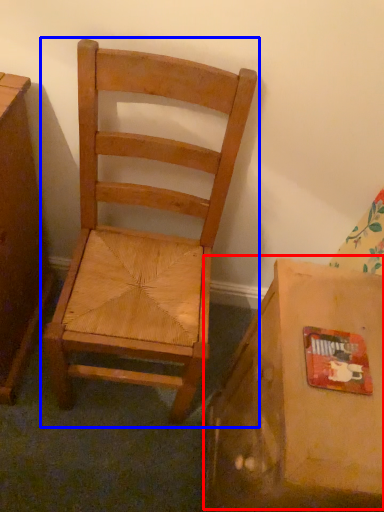
Question: Among these objects, which one is nearest to the camera, cardboard box (highlighted by a red box) or chair (highlighted by a blue box)?

Choices:
 (A) cardboard box
 (B) chair

Answer: (A)